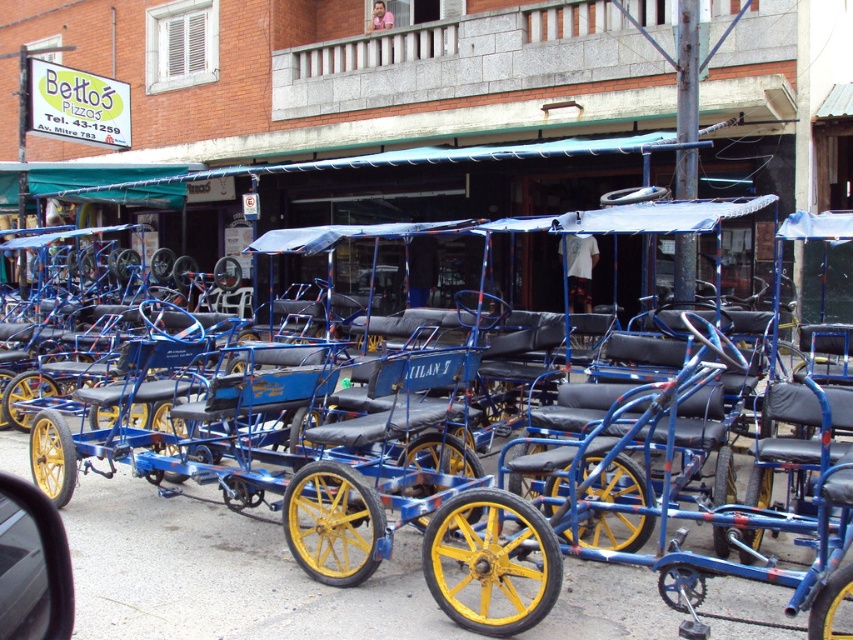
Consider the image. You are a delivery person needing to place a large box between the metallic blue tricycle at center and the metallic blue car at lower left. The box requires 9 feet of space. Can you fit it there?

The metallic blue tricycle at center and metallic blue car at lower left are 8.76 feet apart, so the space between them is insufficient to fit a box requiring 9 feet of space.

What is the relationship in size between the metallic blue tricycle at center and the metallic blue car at lower left?

The metallic blue tricycle at center is bigger than the metallic blue car at lower left.

You are a delivery person who needs to load a package onto the metallic blue car at lower left. However, the metallic blue tricycle at center is blocking the path. Can you move the tricycle to access the car?

The metallic blue car at lower left is behind the metallic blue tricycle at center, so you can move the metallic blue tricycle at center to access the metallic blue car at lower left.